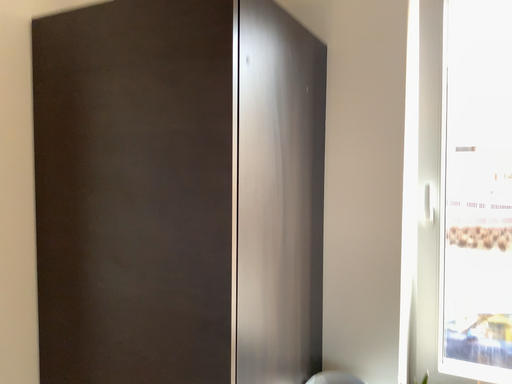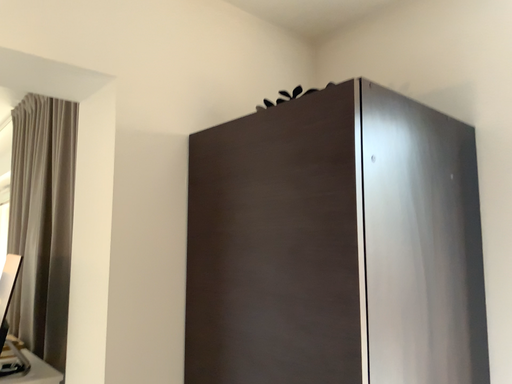
Question: How did the camera likely rotate when shooting the video?

Choices:
 (A) rotated upward
 (B) rotated downward

Answer: (A)